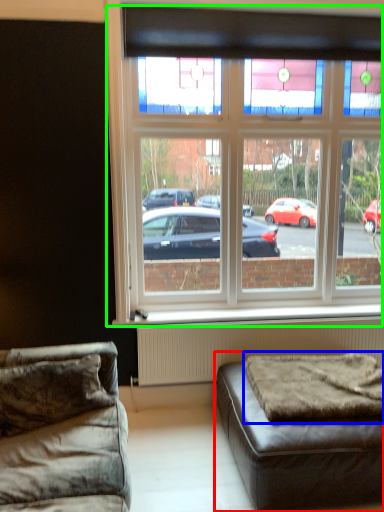
Question: Estimate the real-world distances between objects in this image. Which object is farther from studio couch (highlighted by a red box), mattress (highlighted by a blue box) or window (highlighted by a green box)?

Choices:
 (A) mattress
 (B) window

Answer: (B)